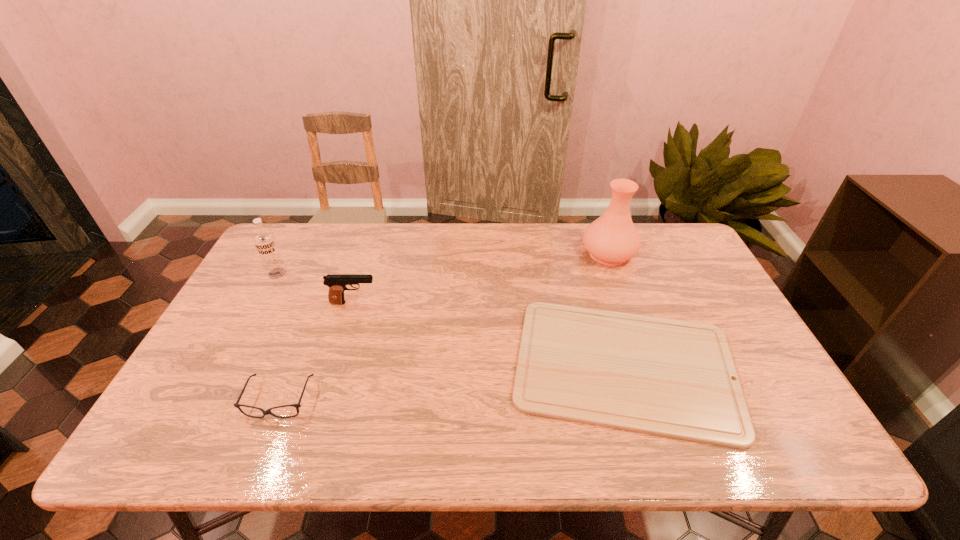
The height and width of the screenshot is (540, 960). In order to click on free space between the third shortest object and the chopping board in this screenshot , I will do `click(490, 334)`.

What are the coordinates of `vacant area that lies between the vase and the chopping board` in the screenshot? It's located at (616, 310).

Identify which object is the fourth closest to the fourth shortest object. Please provide its 2D coordinates. Your answer should be formatted as a tuple, i.e. [(x, y)], where the tuple contains the x and y coordinates of a point satisfying the conditions above.

[(612, 239)]

Point out which object is positioned as the nearest to the pistol. Please provide its 2D coordinates. Your answer should be formatted as a tuple, i.e. [(x, y)], where the tuple contains the x and y coordinates of a point satisfying the conditions above.

[(264, 240)]

Where is `vacant point that satisfies the following two spatial constraints: 1. on the back side of the chopping board; 2. at the barrel of the third tallest object`? Image resolution: width=960 pixels, height=540 pixels. vacant point that satisfies the following two spatial constraints: 1. on the back side of the chopping board; 2. at the barrel of the third tallest object is located at coordinates (606, 303).

You are a GUI agent. You are given a task and a screenshot of the screen. Output one action in this format:
    pyautogui.click(x=<x>, y=<y>)
    Task: Click on the free location that satisfies the following two spatial constraints: 1. on the front side of the vase; 2. at the barrel of the third tallest object
    
    Given the screenshot: What is the action you would take?
    pyautogui.click(x=626, y=303)

At what (x,y) coordinates should I click in order to perform the action: click on vacant region that satisfies the following two spatial constraints: 1. on the front label of the vodka; 2. on the right side of the chopping board. Please return your answer as a coordinate pair (x, y). The image size is (960, 540). Looking at the image, I should click on (228, 366).